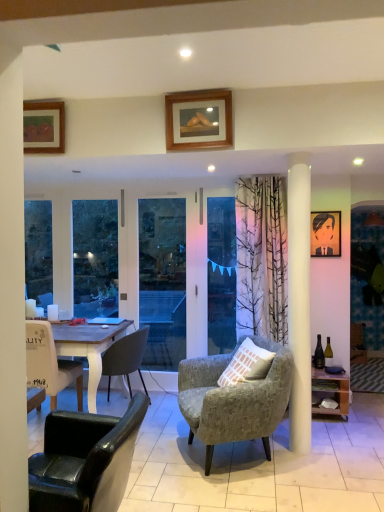
Question: Does wooden-framed artwork at upper left, which is the 2th picture frame from front to back, have a smaller size compared to wooden picture frame at right, the 4th picture frame viewed from the top?

Choices:
 (A) yes
 (B) no

Answer: (A)

Question: Is wooden-framed artwork at upper left, the first picture frame from the top, bigger than wooden picture frame at right, the first picture frame viewed from the right?

Choices:
 (A) no
 (B) yes

Answer: (A)

Question: From a real-world perspective, is wooden-framed artwork at upper left, which is the 2th picture frame from front to back, on top of wooden picture frame at right, the first picture frame viewed from the right?

Choices:
 (A) no
 (B) yes

Answer: (B)

Question: Is wooden-framed artwork at upper left, marked as the 1th picture frame in a left-to-right arrangement, looking in the opposite direction of wooden picture frame at right, the first picture frame viewed from the right?

Choices:
 (A) yes
 (B) no

Answer: (B)

Question: Is the position of wooden-framed artwork at upper left, marked as the 1th picture frame in a left-to-right arrangement, less distant than that of wooden picture frame at right, the first picture frame viewed from the right?

Choices:
 (A) yes
 (B) no

Answer: (A)

Question: From a real-world perspective, is wooden-framed artwork at upper left, which is the 2th picture frame from front to back, beneath wooden picture frame at right, the 4th picture frame viewed from the top?

Choices:
 (A) yes
 (B) no

Answer: (B)

Question: Does dark gray fabric chair at lower left, positioned as the first chair in back-to-front order, have a greater width compared to white matte coffee cup at left?

Choices:
 (A) yes
 (B) no

Answer: (A)

Question: Are dark gray fabric chair at lower left, positioned as the first chair in back-to-front order, and white matte coffee cup at left located far from each other?

Choices:
 (A) yes
 (B) no

Answer: (B)

Question: Is dark gray fabric chair at lower left, positioned as the first chair in back-to-front order, behind white matte coffee cup at left?

Choices:
 (A) no
 (B) yes

Answer: (A)

Question: Can you confirm if dark gray fabric chair at lower left, positioned as the first chair in back-to-front order, is positioned to the right of white matte coffee cup at left?

Choices:
 (A) no
 (B) yes

Answer: (B)

Question: Can you confirm if dark gray fabric chair at lower left, placed as the 3th chair when sorted from front to back, is shorter than white matte coffee cup at left?

Choices:
 (A) yes
 (B) no

Answer: (B)

Question: Does dark gray fabric chair at lower left, placed as the 3th chair when sorted from front to back, have a smaller size compared to white matte coffee cup at left?

Choices:
 (A) yes
 (B) no

Answer: (B)

Question: Is matte black portrait at upper right, positioned as the 3th picture frame in left-to-right order, further to the viewer compared to wooden shelf at right?

Choices:
 (A) yes
 (B) no

Answer: (A)